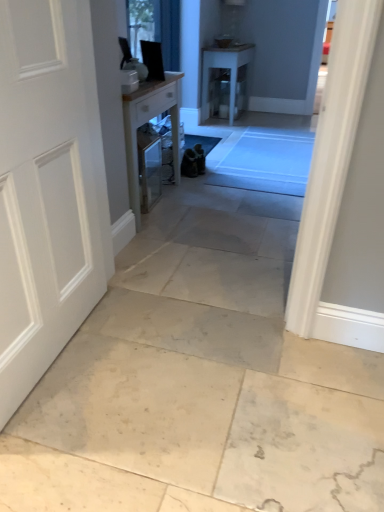
Find the location of `vacant point to the right of wooden table at center, which appears as the 1th table when viewed from the left`. vacant point to the right of wooden table at center, which appears as the 1th table when viewed from the left is located at coordinates (217, 209).